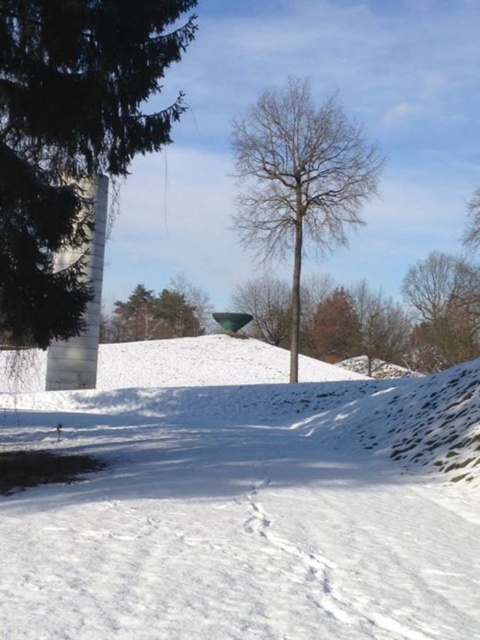
Question: Where is green matte tree at left located in relation to green matte tree at upper center in the image?

Choices:
 (A) right
 (B) left

Answer: (A)

Question: Which object is the farthest from the white snow at center?

Choices:
 (A) brown textured tree at upper right
 (B) green matte tree at upper center
 (C) green matte tree at left

Answer: (B)

Question: Which point is closer to the camera?

Choices:
 (A) (128, 333)
 (B) (6, 10)
 (C) (348, 422)
 (D) (463, 308)

Answer: (B)

Question: Does white snow at center come in front of green matte tree at left?

Choices:
 (A) yes
 (B) no

Answer: (A)

Question: Can you confirm if white snow at center is positioned below green matte tree at left?

Choices:
 (A) yes
 (B) no

Answer: (A)

Question: Based on their relative distances, which object is farther from the bare wood tree at center?

Choices:
 (A) brown textured tree at upper right
 (B) green matte tree at left
 (C) white snow at center
 (D) green matte tree at upper center

Answer: (D)